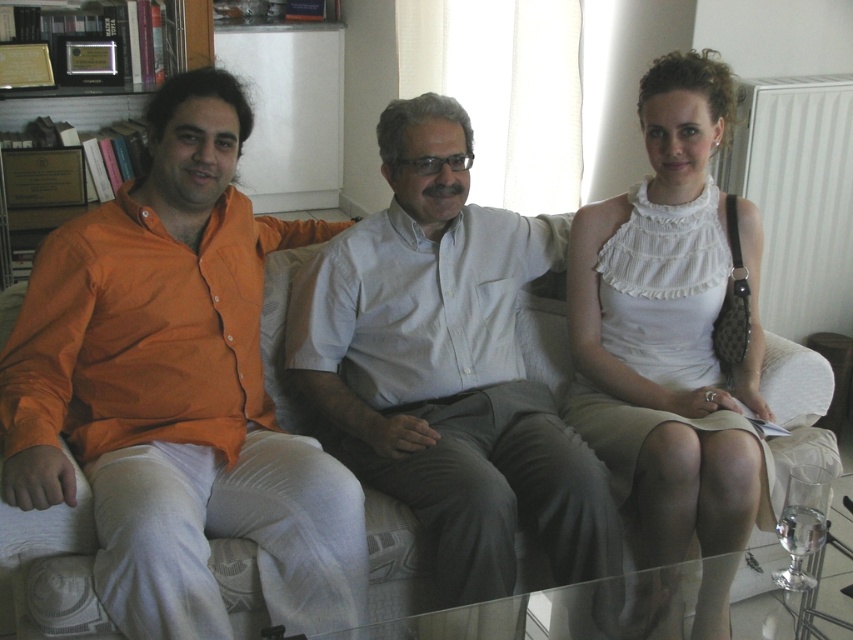
Question: Does orange cotton shirt at left have a lesser width compared to white ruffled blouse at center?

Choices:
 (A) no
 (B) yes

Answer: (A)

Question: Which point is closer to the camera?

Choices:
 (A) (347, 540)
 (B) (189, 28)

Answer: (A)

Question: Which point is closer to the camera taking this photo?

Choices:
 (A) (28, 90)
 (B) (694, 269)
 (C) (107, 376)

Answer: (C)

Question: Can you confirm if white cotton shirt at center is positioned to the right of white ruffled blouse at center?

Choices:
 (A) no
 (B) yes

Answer: (A)

Question: Can you confirm if orange cotton shirt at left is smaller than white ruffled blouse at center?

Choices:
 (A) no
 (B) yes

Answer: (A)

Question: Which of the following is the farthest from the observer?

Choices:
 (A) pyautogui.click(x=485, y=506)
 (B) pyautogui.click(x=96, y=280)
 (C) pyautogui.click(x=746, y=371)

Answer: (C)